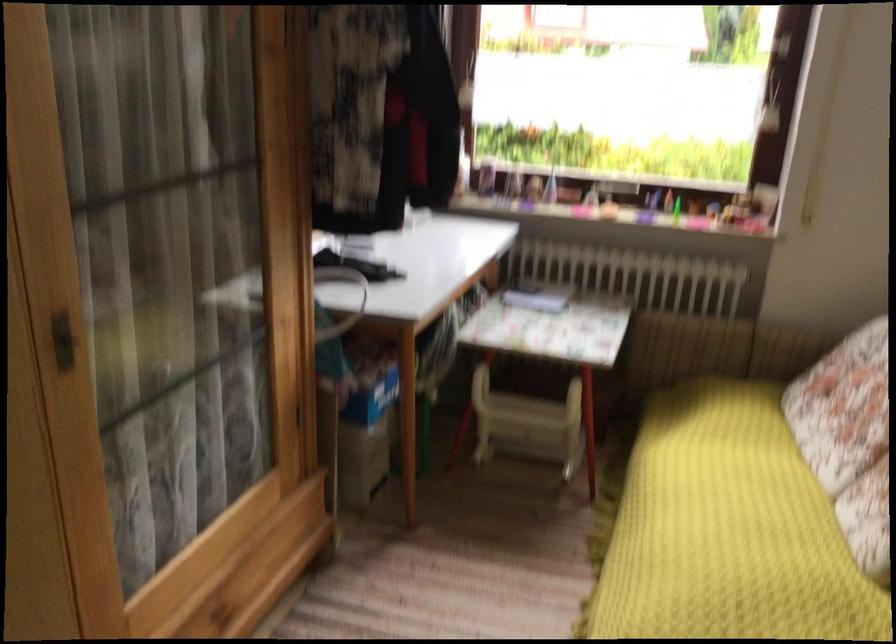
Find where to pull the cabinet door handle. Please return your answer as a coordinate pair (x, y).

(63, 341)